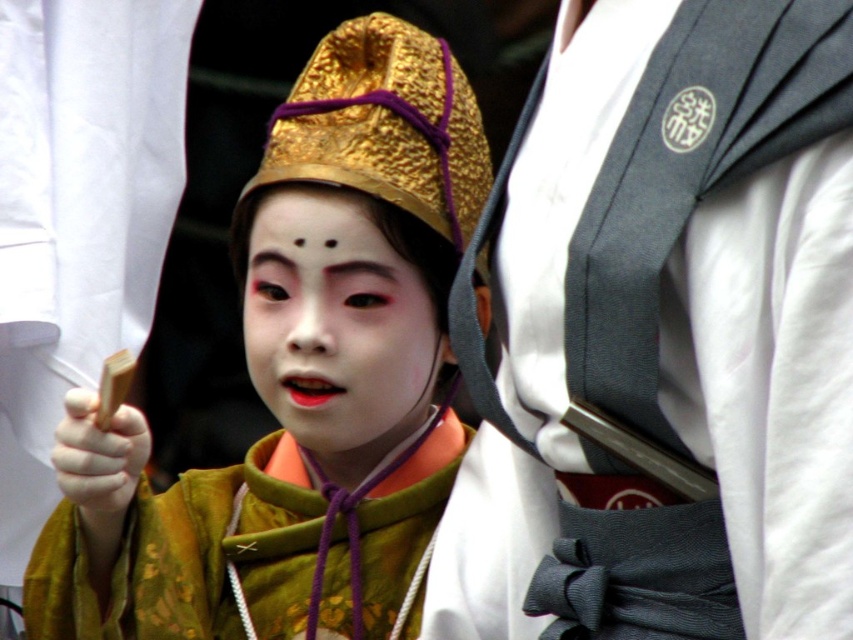
From the picture: You are an assistant helping to prepare for a traditional performance. You see the silky white kimono at center and the matte gold crown at center. Which item is positioned higher on the person?

The silky white kimono at center is located above the matte gold crown at center, so it is positioned higher on the person.

You are standing in a theater audience and see the silky white kimono at center being worn by a performer on stage. If you want to throw a flower to the performer, will you be able to reach them from your current position?

The silky white kimono at center is 10.44 meters away from the viewer. Since this distance is quite far, it would be difficult to accurately throw a flower to the performer from that distance.